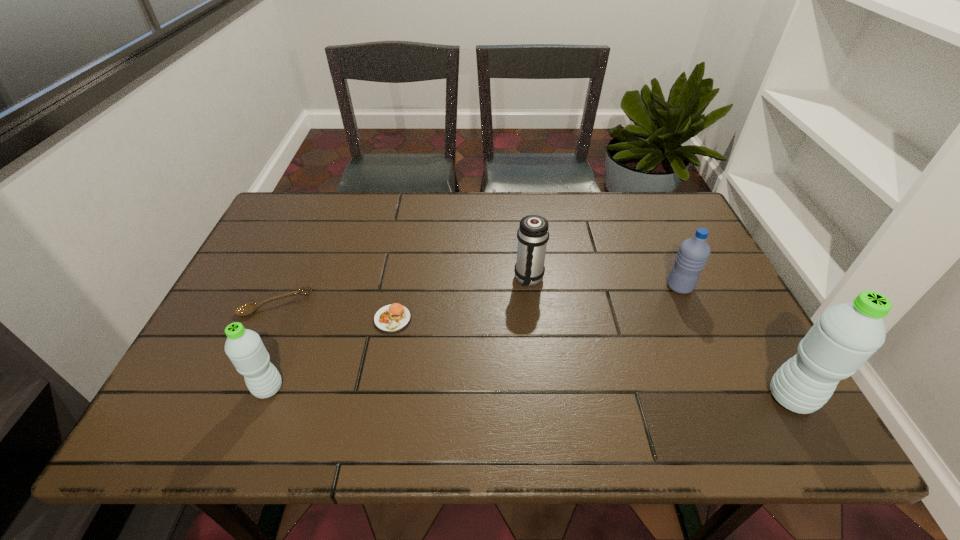
Where is `vacant area in the image that satisfies the following two spatial constraints: 1. on the back side of the shortest object; 2. on the left side of the second water bottle from left to right`? Image resolution: width=960 pixels, height=540 pixels. vacant area in the image that satisfies the following two spatial constraints: 1. on the back side of the shortest object; 2. on the left side of the second water bottle from left to right is located at coordinates (284, 287).